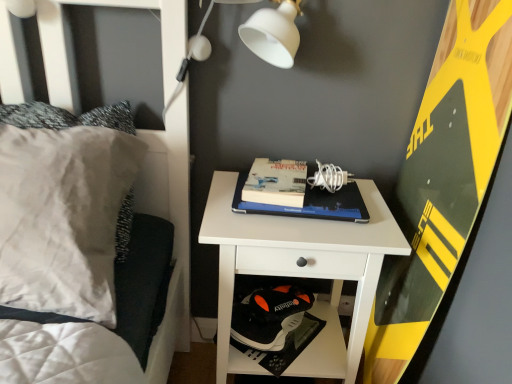
Question: Considering the positions of point (351, 218) and point (466, 236), is point (351, 218) closer or farther from the camera than point (466, 236)?

Choices:
 (A) farther
 (B) closer

Answer: (A)

Question: From a real-world perspective, is hardcover book at center, which is counted as the 2th paperback book, starting from the left, above or below yellow-green textured board at right?

Choices:
 (A) above
 (B) below

Answer: (A)

Question: Based on their relative distances, which object is nearer to the black matte shoe at lower center?

Choices:
 (A) white soft pillow at left
 (B) white matte nightstand at center
 (C) hardcover book at center, which is the 1th paperback book from left to right
 (D) hardcover book at center, which is counted as the 2th paperback book, starting from the left
 (E) yellow-green textured board at right

Answer: (B)

Question: Considering the real-world distances, which object is closest to the white soft pillow at left?

Choices:
 (A) hardcover book at center, which is counted as the 2th paperback book, starting from the left
 (B) white matte nightstand at center
 (C) hardcover book at center, which is the 1th paperback book from left to right
 (D) white matte lampshade at upper center
 (E) yellow-green textured board at right

Answer: (B)